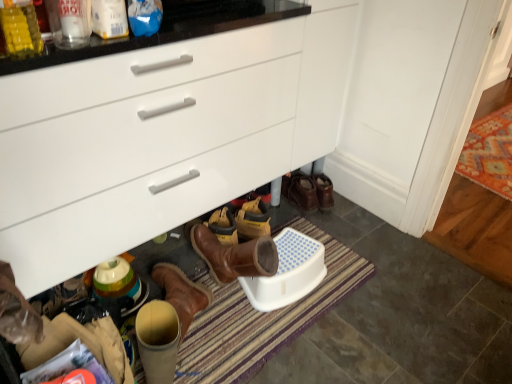
Question: Considering the relative sizes of white glossy cabinet at center and white plastic phone at lower center in the image provided, is white glossy cabinet at center smaller than white plastic phone at lower center?

Choices:
 (A) yes
 (B) no

Answer: (B)

Question: Considering the relative sizes of white glossy cabinet at center and white plastic phone at lower center in the image provided, is white glossy cabinet at center wider than white plastic phone at lower center?

Choices:
 (A) no
 (B) yes

Answer: (B)

Question: From the image's perspective, would you say white glossy cabinet at center is shown under white plastic phone at lower center?

Choices:
 (A) yes
 (B) no

Answer: (B)

Question: From a real-world perspective, is white glossy cabinet at center physically below white plastic phone at lower center?

Choices:
 (A) no
 (B) yes

Answer: (A)

Question: From a real-world perspective, is white glossy cabinet at center positioned over white plastic phone at lower center based on gravity?

Choices:
 (A) yes
 (B) no

Answer: (A)

Question: Considering the positions of white glossy cabinet at center and leather shoes at center in the image, is white glossy cabinet at center taller or shorter than leather shoes at center?

Choices:
 (A) short
 (B) tall

Answer: (B)

Question: From the image's perspective, is white glossy cabinet at center located above or below leather shoes at center?

Choices:
 (A) below
 (B) above

Answer: (B)

Question: In the image, is white glossy cabinet at center positioned in front of or behind leather shoes at center?

Choices:
 (A) front
 (B) behind

Answer: (A)

Question: From a real-world perspective, is white glossy cabinet at center above or below leather shoes at center?

Choices:
 (A) above
 (B) below

Answer: (A)

Question: Does point (192, 216) appear closer or farther from the camera than point (500, 122)?

Choices:
 (A) closer
 (B) farther

Answer: (A)

Question: Is white glossy cabinet at center in front of or behind orange patterned rug at lower right in the image?

Choices:
 (A) behind
 (B) front

Answer: (B)

Question: Is white glossy cabinet at center taller or shorter than orange patterned rug at lower right?

Choices:
 (A) tall
 (B) short

Answer: (A)

Question: Is white glossy cabinet at center inside or outside of orange patterned rug at lower right?

Choices:
 (A) inside
 (B) outside

Answer: (B)

Question: Is orange patterned rug at lower right inside or outside of white plastic phone at lower center?

Choices:
 (A) inside
 (B) outside

Answer: (B)

Question: Considering the relative positions of orange patterned rug at lower right and white plastic phone at lower center in the image provided, is orange patterned rug at lower right to the left or to the right of white plastic phone at lower center?

Choices:
 (A) left
 (B) right

Answer: (B)